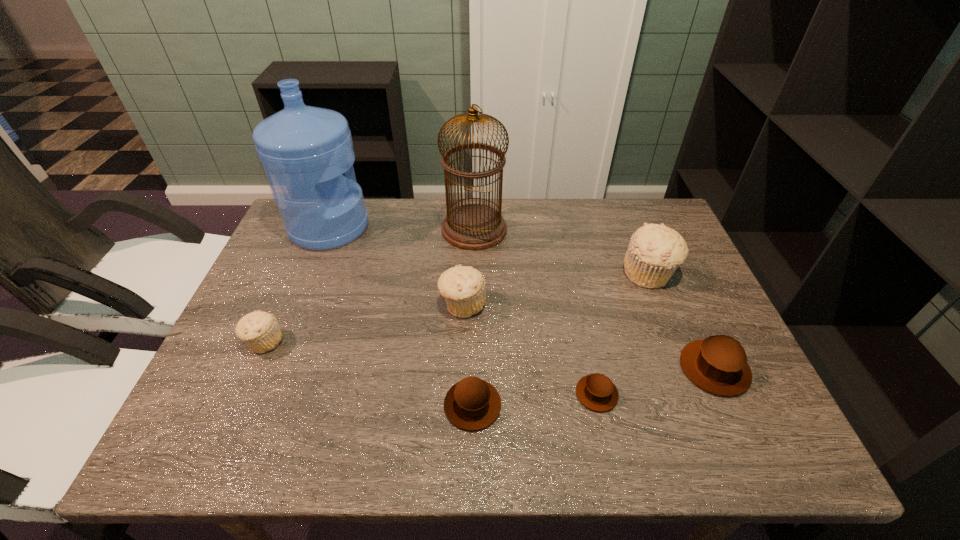
Where is `free spot that satisfies the following two spatial constraints: 1. on the side of the water jug with the handle; 2. on the right side of the rightmost brown muffin`? The width and height of the screenshot is (960, 540). free spot that satisfies the following two spatial constraints: 1. on the side of the water jug with the handle; 2. on the right side of the rightmost brown muffin is located at coordinates (273, 369).

What are the coordinates of `vacant space that satisfies the following two spatial constraints: 1. on the front-facing side of the birdcage; 2. on the left side of the rightmost beige muffin` in the screenshot? It's located at (473, 273).

The width and height of the screenshot is (960, 540). What are the coordinates of `vacant space that satisfies the following two spatial constraints: 1. on the front-facing side of the birdcage; 2. on the left side of the biggest brown muffin` in the screenshot? It's located at (472, 369).

You are a GUI agent. You are given a task and a screenshot of the screen. Output one action in this format:
    pyautogui.click(x=<x>, y=<y>)
    Task: Click on the free space that satisfies the following two spatial constraints: 1. on the front-facing side of the birdcage; 2. on the back side of the tallest muffin
    The image size is (960, 540).
    Given the screenshot: What is the action you would take?
    pyautogui.click(x=473, y=273)